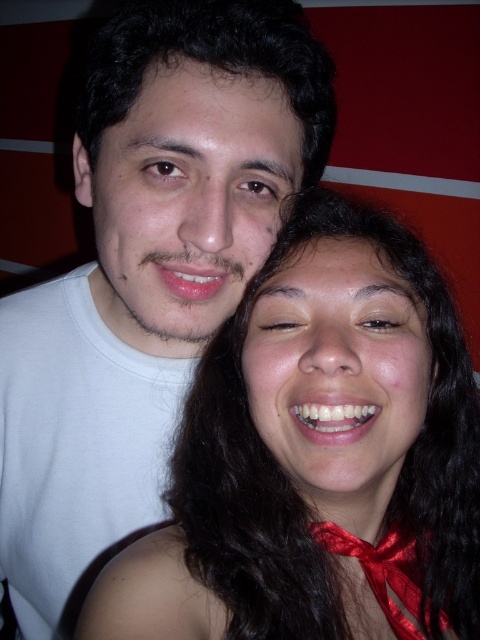
Question: Which point appears farthest from the camera in this image?

Choices:
 (A) (166, 161)
 (B) (316, 227)

Answer: (B)

Question: Does smooth skin face at center have a greater width compared to white matte t-shirt at center?

Choices:
 (A) no
 (B) yes

Answer: (A)

Question: Does smooth skin face at center have a larger size compared to white matte t-shirt at center?

Choices:
 (A) no
 (B) yes

Answer: (A)

Question: Observing the image, what is the correct spatial positioning of white matte t-shirt at center in reference to shiny red bow tie at lower right?

Choices:
 (A) left
 (B) right

Answer: (A)

Question: Which of the following is the farthest from the observer?

Choices:
 (A) white matte t-shirt at center
 (B) smooth skin face at center

Answer: (A)

Question: Which point appears closest to the camera in this image?

Choices:
 (A) (97, 156)
 (B) (397, 614)

Answer: (A)